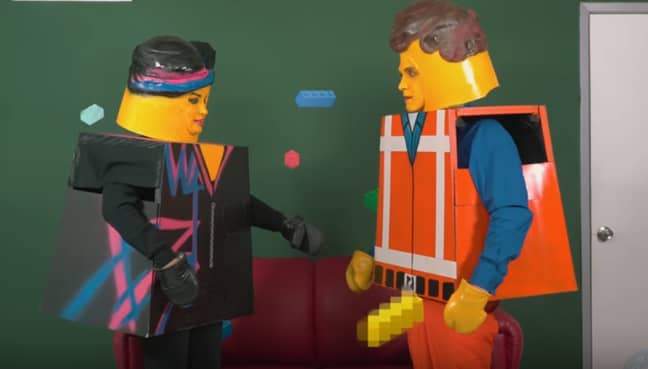
Find the location of a particular element. This screenshot has height=369, width=648. door frame on left side of door is located at coordinates (584, 73).